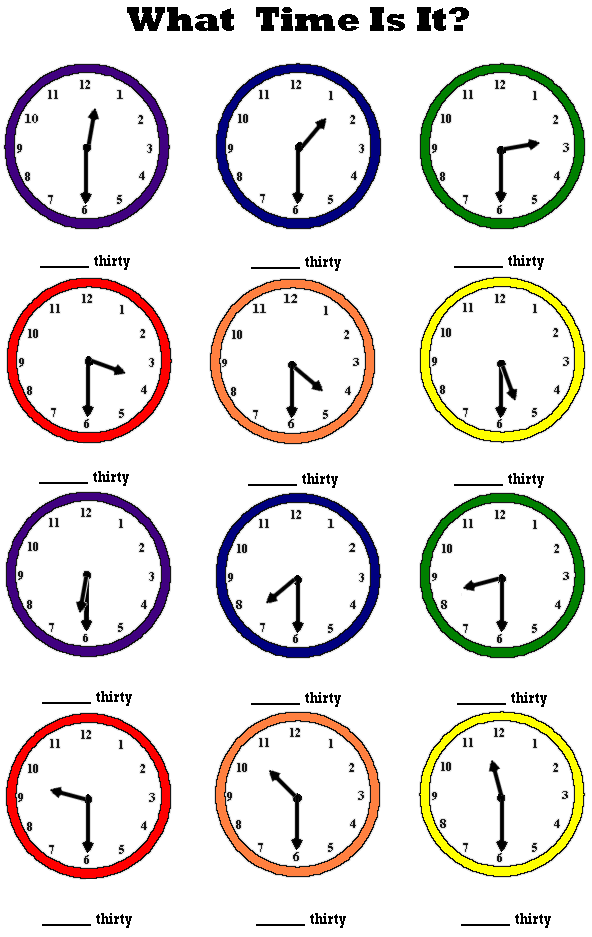
This screenshot has height=937, width=592. Identify the location of orange clock. (318, 350), (321, 812).